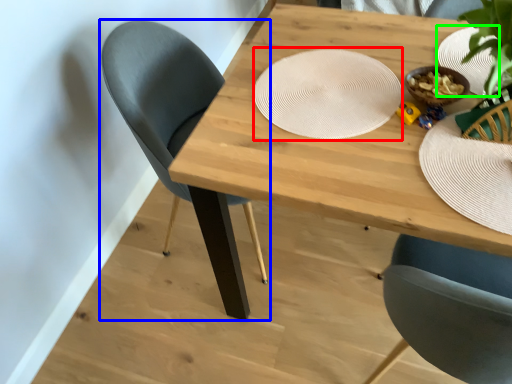
Question: Based on their relative distances, which object is farther from platter (highlighted by a red box)? Choose from chair (highlighted by a blue box) and paper plate (highlighted by a green box).

Choices:
 (A) chair
 (B) paper plate

Answer: (A)